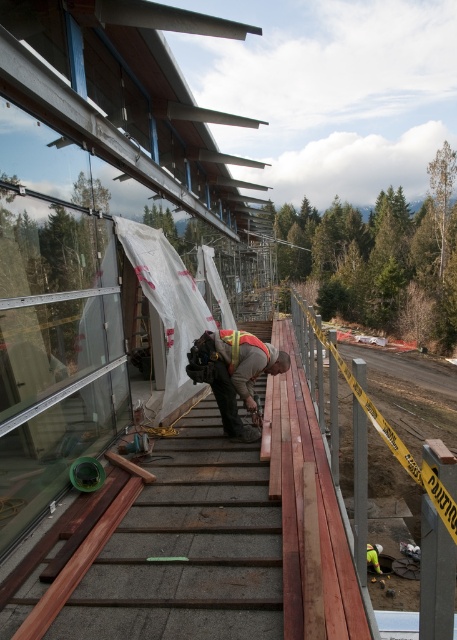
You are a safety inspector visiting the construction site. You notice the smooth wood stairs at center and the reflective safety vest at center. Which object takes up more space in the image?

The smooth wood stairs at center is bigger than reflective safety vest at center, so the smooth wood stairs at center takes up more space in the image.

Based on the photo, you are a safety inspector at the construction site. You need to ensure that the reflective safety vest at center and the reflective orange safety vest at center are at least 10 inches apart for visibility. Based on the image, are they meeting the safety requirement?

The reflective safety vest at center and the reflective orange safety vest at center are 7.98 inches apart, which is less than the required 10 inches. Therefore, they are not meeting the safety requirement.

Based on the scene description, can you determine the spatial relationship between the smooth wood stairs at center and the reflective safety vest at center?

The smooth wood stairs at center are located to the left of the reflective safety vest at center.